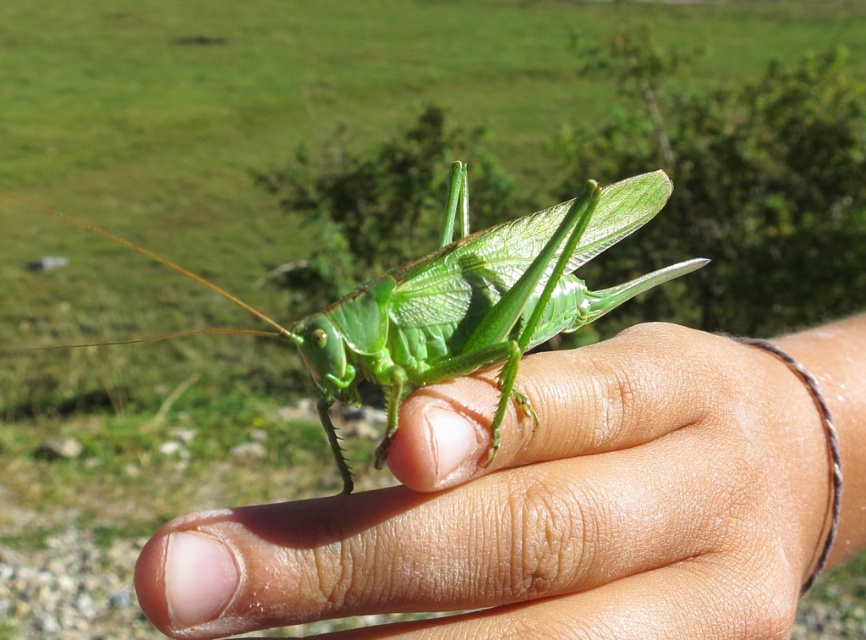
Question: Is smooth skin hand at center wider than green matte grasshopper at center?

Choices:
 (A) yes
 (B) no

Answer: (A)

Question: Which point is closer to the camera taking this photo?

Choices:
 (A) (564, 202)
 (B) (658, 438)

Answer: (B)

Question: Where is smooth skin hand at center located in relation to green matte grasshopper at center in the image?

Choices:
 (A) above
 (B) below

Answer: (B)

Question: Does smooth skin hand at center lie in front of green matte grasshopper at center?

Choices:
 (A) yes
 (B) no

Answer: (A)

Question: Which point is closer to the camera taking this photo?

Choices:
 (A) (844, 506)
 (B) (593, 317)

Answer: (B)